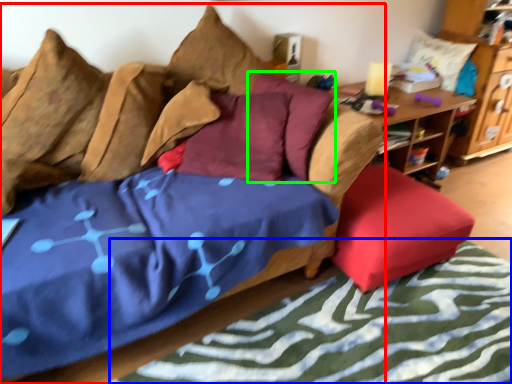
Question: Considering the real-world distances, which object is farthest from studio couch (highlighted by a red box)? bed frame (highlighted by a blue box) or pillow (highlighted by a green box)?

Choices:
 (A) bed frame
 (B) pillow

Answer: (A)